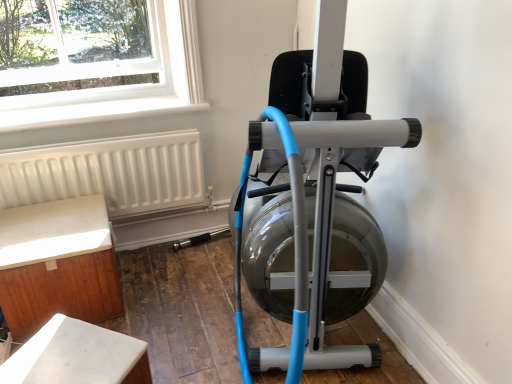
Question: Is white matte radiator at lower left at the left side of matte silver stationary bicycle at center?

Choices:
 (A) yes
 (B) no

Answer: (A)

Question: Can you confirm if white matte radiator at lower left is taller than matte silver stationary bicycle at center?

Choices:
 (A) no
 (B) yes

Answer: (A)

Question: From the image's perspective, is white matte radiator at lower left located beneath matte silver stationary bicycle at center?

Choices:
 (A) no
 (B) yes

Answer: (B)

Question: From a real-world perspective, is white matte radiator at lower left positioned over matte silver stationary bicycle at center based on gravity?

Choices:
 (A) no
 (B) yes

Answer: (A)

Question: Is white matte radiator at lower left touching matte silver stationary bicycle at center?

Choices:
 (A) yes
 (B) no

Answer: (B)

Question: Can you confirm if white matte radiator at lower left is bigger than matte silver stationary bicycle at center?

Choices:
 (A) yes
 (B) no

Answer: (B)

Question: Is matte silver stationary bicycle at center next to white wood cabinet at lower left, which is the second furniture from front to back, and touching it?

Choices:
 (A) yes
 (B) no

Answer: (B)

Question: From a real-world perspective, does matte silver stationary bicycle at center stand above white wood cabinet at lower left, which is counted as the first furniture, starting from the back?

Choices:
 (A) yes
 (B) no

Answer: (A)

Question: Considering the relative sizes of matte silver stationary bicycle at center and white wood cabinet at lower left, which is the second furniture from front to back, in the image provided, is matte silver stationary bicycle at center shorter than white wood cabinet at lower left, which is the second furniture from front to back,?

Choices:
 (A) yes
 (B) no

Answer: (B)

Question: From a real-world perspective, is matte silver stationary bicycle at center physically below white wood cabinet at lower left, which is the second furniture from front to back?

Choices:
 (A) no
 (B) yes

Answer: (A)

Question: Are matte silver stationary bicycle at center and white wood cabinet at lower left, which is the second furniture from front to back, located far from each other?

Choices:
 (A) no
 (B) yes

Answer: (A)

Question: Can white wood cabinet at lower left, which is the second furniture from front to back, be found inside matte silver stationary bicycle at center?

Choices:
 (A) yes
 (B) no

Answer: (B)

Question: From the image's perspective, is matte silver stationary bicycle at center on white matte radiator at lower left?

Choices:
 (A) no
 (B) yes

Answer: (B)